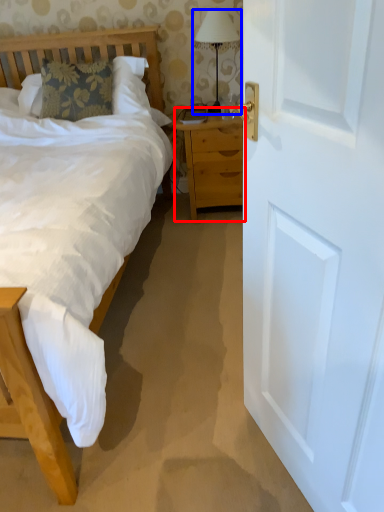
Question: Which object appears farthest to the camera in this image, nightstand (highlighted by a red box) or bedside lamp (highlighted by a blue box)?

Choices:
 (A) nightstand
 (B) bedside lamp

Answer: (A)